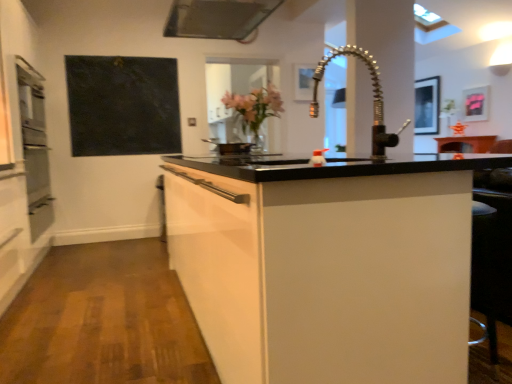
In the scene shown: Measure the distance between black matte board at upper left and camera.

black matte board at upper left and camera are 4.26 meters apart from each other.

Measure the distance between point (94, 153) and camera.

The depth of point (94, 153) is 4.42 meters.

The image size is (512, 384). What do you see at coordinates (327, 264) in the screenshot? I see `white glossy cabinet at center` at bounding box center [327, 264].

Where is `black matte pan at center`? The height and width of the screenshot is (384, 512). black matte pan at center is located at coordinates (230, 147).

The image size is (512, 384). I want to click on metallic silver picture frame at upper right, which is counted as the first picture frame, starting from the right, so click(475, 104).

Find the location of a particular element. This screenshot has width=512, height=384. metallic silver picture frame at upper right, placed as the second picture frame when sorted from right to left is located at coordinates (426, 106).

From the image's perspective, between metallic silver exhaust hood at upper center and metallic silver picture frame at upper right, the third picture frame positioned from the left, which one is located above?

metallic silver exhaust hood at upper center, from the image's perspective.

From a real-world perspective, is metallic silver exhaust hood at upper center beneath metallic silver picture frame at upper right, the third picture frame positioned from the left?

No.

Is metallic silver exhaust hood at upper center to the right of metallic silver picture frame at upper right, marked as the 2th picture frame in a front-to-back arrangement, from the viewer's perspective?

No.

From the image's perspective, does black matte board at upper left appear lower than white glossy cabinet at center?

No.

Looking at this image, in the image, is black matte board at upper left on the left side or the right side of white glossy cabinet at center?

Based on their positions, black matte board at upper left is located to the left of white glossy cabinet at center.

Measure the distance between black matte board at upper left and white glossy cabinet at center.

The distance of black matte board at upper left from white glossy cabinet at center is 8.61 feet.

Is black matte board at upper left next to white glossy cabinet at center and touching it?

They are not placed beside each other.

Is white glossy cabinet at center smaller than metallic silver exhaust hood at upper center?

Actually, white glossy cabinet at center might be larger than metallic silver exhaust hood at upper center.

In the scene shown: Is white glossy cabinet at center turned away from metallic silver exhaust hood at upper center?

No, metallic silver exhaust hood at upper center is not at the back of white glossy cabinet at center.

Between point (309, 323) and point (231, 20), which one is positioned in front?

The point (309, 323) is in front.

Considering the relative sizes of white glossy cabinet at center and metallic silver exhaust hood at upper center in the image provided, is white glossy cabinet at center wider than metallic silver exhaust hood at upper center?

Indeed, white glossy cabinet at center has a greater width compared to metallic silver exhaust hood at upper center.

In the scene shown: Considering the relative sizes of metallic silver exhaust hood at upper center and metallic silver picture frame at upper center, marked as the third picture frame in a back-to-front arrangement, in the image provided, is metallic silver exhaust hood at upper center smaller than metallic silver picture frame at upper center, marked as the third picture frame in a back-to-front arrangement,?

Incorrect, metallic silver exhaust hood at upper center is not smaller in size than metallic silver picture frame at upper center, marked as the third picture frame in a back-to-front arrangement.

Would you say metallic silver exhaust hood at upper center is to the left or to the right of metallic silver picture frame at upper center, marked as the first picture frame in a left-to-right arrangement, in the picture?

From the image, it's evident that metallic silver exhaust hood at upper center is to the left of metallic silver picture frame at upper center, marked as the first picture frame in a left-to-right arrangement.

From a real-world perspective, which object stands above the other?

metallic silver exhaust hood at upper center, from a real-world perspective.

Is point (223, 154) positioned in front of point (374, 156)?

No, (223, 154) is behind (374, 156).

Does black matte pan at center have a larger size compared to satin nickel faucet at center?

Yes, black matte pan at center is bigger than satin nickel faucet at center.

Considering the relative positions of black matte pan at center and satin nickel faucet at center in the image provided, is black matte pan at center to the left of satin nickel faucet at center from the viewer's perspective?

Correct, you'll find black matte pan at center to the left of satin nickel faucet at center.

Is black matte pan at center wider or thinner than satin nickel faucet at center?

In the image, black matte pan at center appears to be wider than satin nickel faucet at center.

How distant is metallic silver picture frame at upper right, which ranks as the 3th picture frame in front-to-back order, from black matte pan at center?

metallic silver picture frame at upper right, which ranks as the 3th picture frame in front-to-back order, is 16.91 feet from black matte pan at center.

How different are the orientations of metallic silver picture frame at upper right, the first picture frame in the back-to-front sequence, and black matte pan at center in degrees?

The angle between the facing direction of metallic silver picture frame at upper right, the first picture frame in the back-to-front sequence, and the facing direction of black matte pan at center is 129 degrees.

Is the surface of metallic silver picture frame at upper right, the first picture frame in the back-to-front sequence, in direct contact with black matte pan at center?

No, metallic silver picture frame at upper right, the first picture frame in the back-to-front sequence, is not making contact with black matte pan at center.

Between metallic silver picture frame at upper right, which ranks as the 3th picture frame in front-to-back order, and black matte pan at center, which one has smaller width?

With smaller width is metallic silver picture frame at upper right, which ranks as the 3th picture frame in front-to-back order.

Would you say metallic silver picture frame at upper right, which appears as the second picture frame when viewed from the left, is part of black matte pan at center's contents?

Actually, metallic silver picture frame at upper right, which appears as the second picture frame when viewed from the left, is outside black matte pan at center.

From the image's perspective, is black matte pan at center below metallic silver picture frame at upper right, the first picture frame in the back-to-front sequence?

Correct, black matte pan at center appears lower than metallic silver picture frame at upper right, the first picture frame in the back-to-front sequence, in the image.

Can you confirm if black matte pan at center is bigger than metallic silver picture frame at upper right, which appears as the second picture frame when viewed from the left?

Incorrect, black matte pan at center is not larger than metallic silver picture frame at upper right, which appears as the second picture frame when viewed from the left.

Is the depth of black matte pan at center greater than that of metallic silver picture frame at upper right, which ranks as the 3th picture frame in front-to-back order?

That is False.

The height and width of the screenshot is (384, 512). I want to click on picture frame below the metallic silver exhaust hood at upper center (from the image's perspective), so click(475, 104).

You are a GUI agent. You are given a task and a screenshot of the screen. Output one action in this format:
    pyautogui.click(x=<x>, y=<y>)
    Task: Click on the cabinetry that appears below the black matte board at upper left (from a real-world perspective)
    
    Given the screenshot: What is the action you would take?
    pyautogui.click(x=327, y=264)

Considering their positions, is metallic silver picture frame at upper right, the first picture frame in the back-to-front sequence, positioned further to satin nickel faucet at center than metallic silver picture frame at upper center, marked as the third picture frame in a back-to-front arrangement?

Among the two, metallic silver picture frame at upper right, the first picture frame in the back-to-front sequence, is located further to satin nickel faucet at center.

Based on their spatial positions, is metallic silver exhaust hood at upper center or black matte pan at center further from black matte board at upper left?

metallic silver exhaust hood at upper center.

Looking at the image, which one is located closer to metallic silver picture frame at upper right, which appears as the second picture frame when viewed from the left, metallic silver picture frame at upper right, which is the second picture frame in back-to-front order, or metallic silver picture frame at upper center, arranged as the first picture frame when viewed from the front?

metallic silver picture frame at upper right, which is the second picture frame in back-to-front order, is positioned closer to the anchor metallic silver picture frame at upper right, which appears as the second picture frame when viewed from the left.

Estimate the real-world distances between objects in this image. Which object is closer to white glossy cabinet at center, metallic silver picture frame at upper right, which is counted as the first picture frame, starting from the right, or black matte pan at center?

black matte pan at center.

From the image, which object appears to be nearer to metallic silver exhaust hood at upper center, satin nickel faucet at center or white glossy cabinet at center?

satin nickel faucet at center is closer to metallic silver exhaust hood at upper center.

From the image, which object appears to be farther from black matte board at upper left, metallic silver exhaust hood at upper center or satin nickel faucet at center?

satin nickel faucet at center.

Looking at the image, which one is located closer to white glossy cabinet at center, metallic silver picture frame at upper right, the third picture frame positioned from the left, or metallic silver picture frame at upper right, which ranks as the 3th picture frame in front-to-back order?

Based on the image, metallic silver picture frame at upper right, which ranks as the 3th picture frame in front-to-back order, appears to be nearer to white glossy cabinet at center.

Which object lies nearer to the anchor point satin nickel faucet at center, metallic silver picture frame at upper center, arranged as the first picture frame when viewed from the front, or metallic silver picture frame at upper right, which ranks as the 3th picture frame in front-to-back order?

Based on the image, metallic silver picture frame at upper center, arranged as the first picture frame when viewed from the front, appears to be nearer to satin nickel faucet at center.

Find the location of `tap positioned between white glossy cabinet at center and metallic silver picture frame at upper right, marked as the 2th picture frame in a front-to-back arrangement, from near to far`. tap positioned between white glossy cabinet at center and metallic silver picture frame at upper right, marked as the 2th picture frame in a front-to-back arrangement, from near to far is located at coordinates (373, 97).

Where is `exhaust hood between white glossy cabinet at center and metallic silver picture frame at upper right, marked as the 2th picture frame in a front-to-back arrangement, in the front-back direction`? This screenshot has height=384, width=512. exhaust hood between white glossy cabinet at center and metallic silver picture frame at upper right, marked as the 2th picture frame in a front-to-back arrangement, in the front-back direction is located at coordinates (218, 18).

Where is `appliance between black matte board at upper left and metallic silver picture frame at upper right, marked as the 2th picture frame in a front-to-back arrangement, from left to right`? appliance between black matte board at upper left and metallic silver picture frame at upper right, marked as the 2th picture frame in a front-to-back arrangement, from left to right is located at coordinates (230, 147).

Find the location of a particular element. appliance between satin nickel faucet at center and metallic silver picture frame at upper right, which is counted as the first picture frame, starting from the right, along the z-axis is located at coordinates (230, 147).